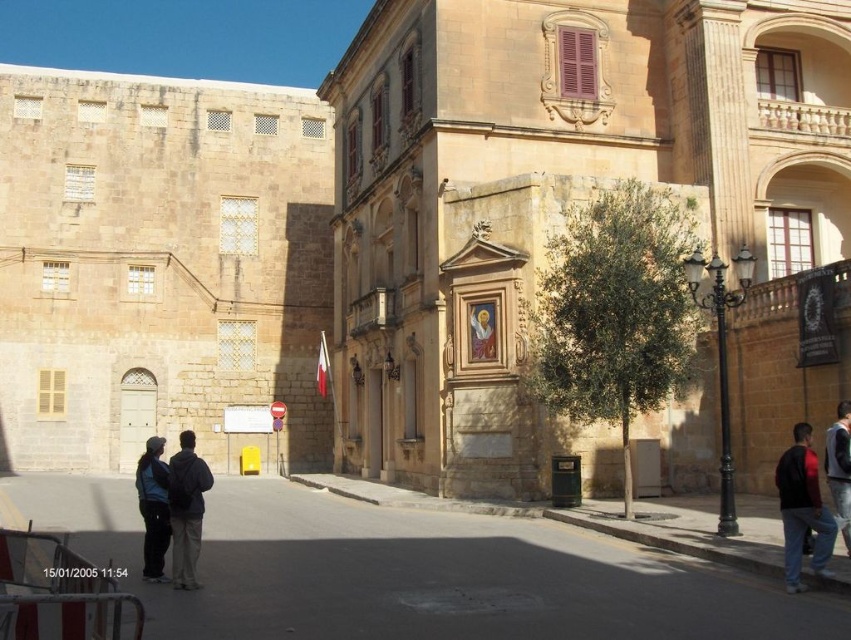
Between dark red jacket at lower right and dark blue sweater at lower right, which one appears on the left side from the viewer's perspective?

Positioned to the left is dark red jacket at lower right.

Is point (808, 492) positioned behind point (844, 435)?

No, (808, 492) is in front of (844, 435).

This screenshot has width=851, height=640. I want to click on dark red jacket at lower right, so click(x=802, y=508).

Does dark blue jeans at lower left appear on the left side of dark blue sweater at lower right?

Indeed, dark blue jeans at lower left is positioned on the left side of dark blue sweater at lower right.

Does dark blue jeans at lower left have a smaller size compared to dark blue sweater at lower right?

No, dark blue jeans at lower left is not smaller than dark blue sweater at lower right.

Which is in front, point (140, 481) or point (847, 449)?

Positioned in front is point (140, 481).

This screenshot has height=640, width=851. What are the coordinates of `dark blue jeans at lower left` in the screenshot? It's located at (153, 508).

Can you confirm if dark red jacket at lower right is positioned to the right of dark gray backpack at center?

Indeed, dark red jacket at lower right is positioned on the right side of dark gray backpack at center.

Is dark red jacket at lower right positioned before dark gray backpack at center?

Yes, it is.

Is point (780, 460) positioned before point (198, 548)?

That is False.

The image size is (851, 640). I want to click on dark red jacket at lower right, so click(x=802, y=508).